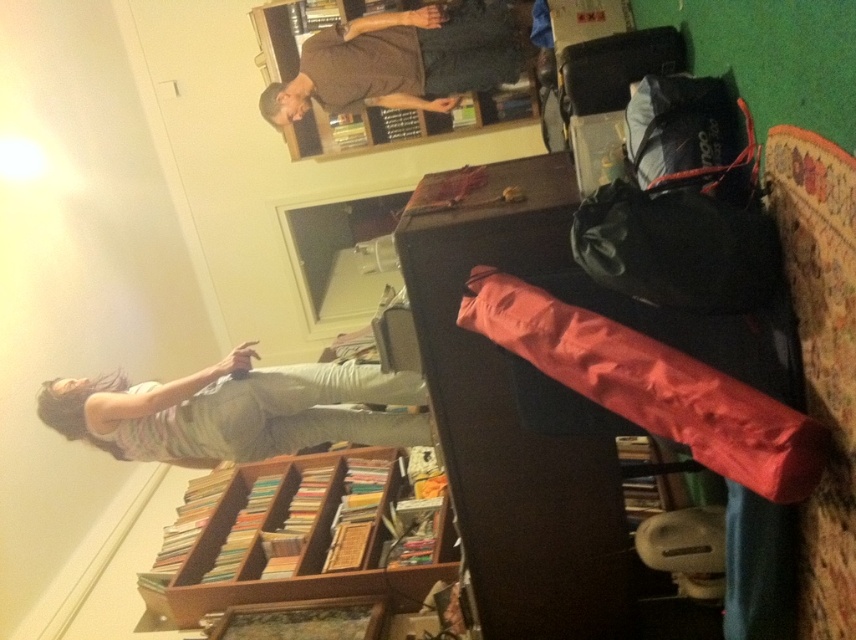
Does wooden bookshelf at lower center have a larger size compared to brown matte shirt at upper center?

Yes, wooden bookshelf at lower center is bigger than brown matte shirt at upper center.

In the scene shown: Which is more to the left, wooden bookshelf at lower center or brown matte shirt at upper center?

wooden bookshelf at lower center

Which is in front, point (390, 458) or point (305, 106)?

Point (390, 458) is more forward.

Where is `wooden bookshelf at lower center`? The height and width of the screenshot is (640, 856). wooden bookshelf at lower center is located at coordinates (296, 544).

In the scene shown: Does striped cotton shirt at lower left have a larger size compared to brown matte shirt at upper center?

No, striped cotton shirt at lower left is not bigger than brown matte shirt at upper center.

Which is in front, point (337, 435) or point (431, 48)?

Point (337, 435) is more forward.

Find the location of a particular element. striped cotton shirt at lower left is located at coordinates (236, 412).

Can you confirm if wooden bookshelf at lower center is bigger than striped cotton shirt at lower left?

Correct, wooden bookshelf at lower center is larger in size than striped cotton shirt at lower left.

Is wooden bookshelf at lower center wider than striped cotton shirt at lower left?

Incorrect, wooden bookshelf at lower center's width does not surpass striped cotton shirt at lower left's.

Is point (183, 577) closer to camera compared to point (238, 385)?

No, it is behind (238, 385).

Find the location of `wooden bookshelf at lower center`. wooden bookshelf at lower center is located at coordinates (296, 544).